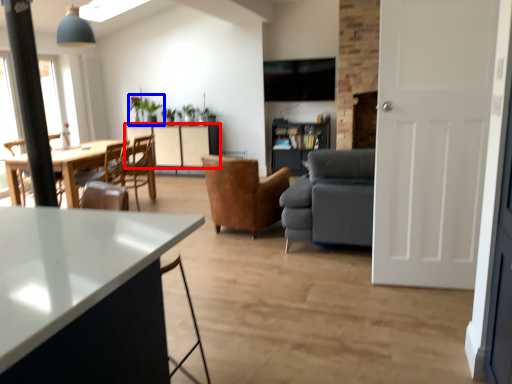
Question: Which object is closer to the camera taking this photo, cabinetry (highlighted by a red box) or houseplant (highlighted by a blue box)?

Choices:
 (A) cabinetry
 (B) houseplant

Answer: (A)